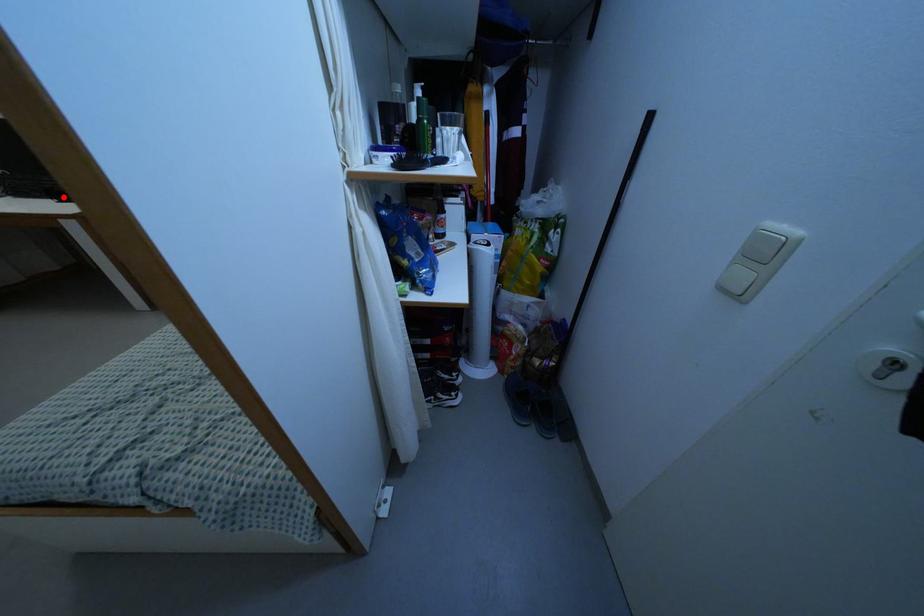
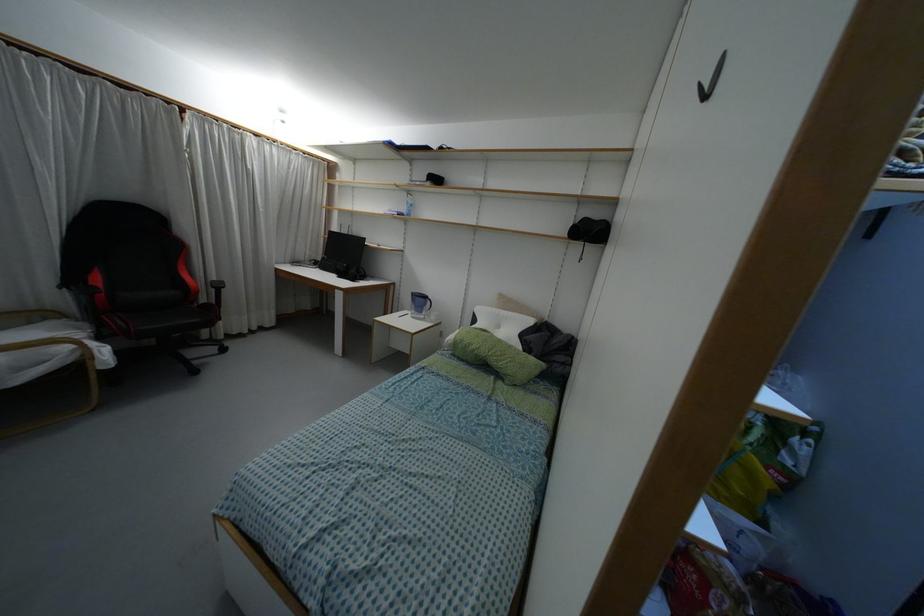
Locate, in the second image, the point that corresponds to the highlighted location in the first image.

(341, 275)